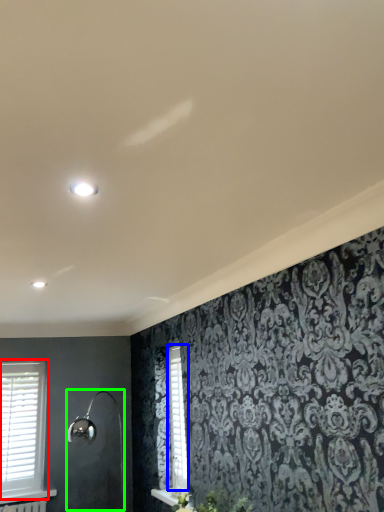
Question: Based on their relative distances, which object is nearer to window (highlighted by a red box)? Choose from shutter (highlighted by a blue box) and shower (highlighted by a green box).

Choices:
 (A) shutter
 (B) shower

Answer: (B)